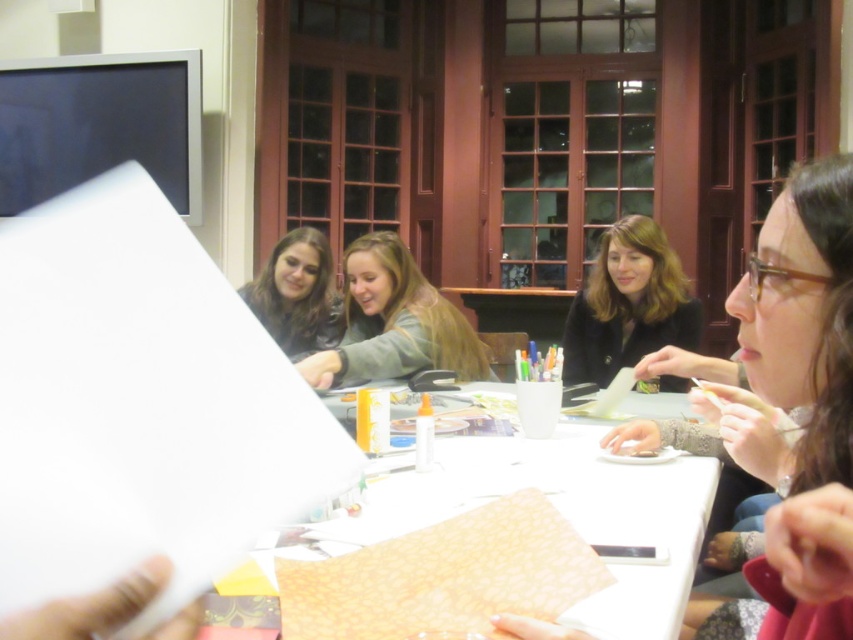
You are a tailor who needs to determine if the smooth beige sweater at center can be folded and placed into a storage box designed to hold items no larger than the matte brown hair at center. Based on their sizes, will the sweater fit?

The smooth beige sweater at center is bigger than the matte brown hair at center, so it will not fit into the storage box designed for items no larger than the matte brown hair at center.

You are sitting at the table and want to reach the matte brown hair at center without moving the black matte jacket at center. Is this possible?

The black matte jacket at center is in front of the matte brown hair at center, so you cannot reach the matte brown hair at center without moving the black matte jacket at center.